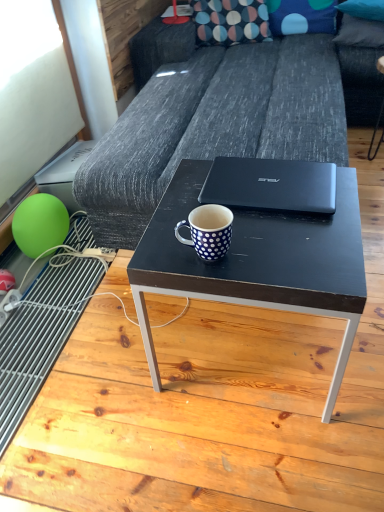
Question: Is point (278, 1) positioned closer to the camera than point (360, 39)?

Choices:
 (A) farther
 (B) closer

Answer: (A)

Question: From the image's perspective, is blue dotted fabric pillow at upper center, the second pillow from the right, above or below blue dotted fabric pillow at upper right, the 1th pillow in the right-to-left sequence?

Choices:
 (A) below
 (B) above

Answer: (B)

Question: Which is nearer to the matte black coffee table at center?

Choices:
 (A) dark gray fabric couch at center
 (B) blue dotted fabric pillow at upper right, the third pillow positioned from the left
 (C) blue dotted fabric pillow at upper center, the 2th pillow in the left-to-right sequence
 (D) blue dotted mug at center
 (E) black matte laptop at center

Answer: (E)

Question: Which of these objects is positioned closest to the green rubber balloon at lower left?

Choices:
 (A) black matte laptop at center
 (B) black matte table at center
 (C) polka dot fabric pillow at upper center, the 3th pillow from the right
 (D) matte black coffee table at center
 (E) blue dotted fabric pillow at upper right, the third pillow positioned from the left

Answer: (B)